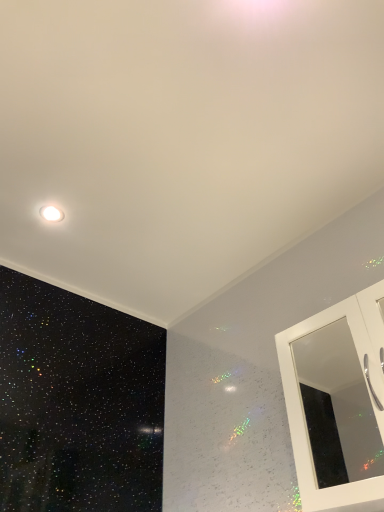
Image resolution: width=384 pixels, height=512 pixels. Describe the element at coordinates (337, 403) in the screenshot. I see `white glossy cabinet door at upper right` at that location.

The height and width of the screenshot is (512, 384). Find the location of `white glossy cabinet door at upper right`. white glossy cabinet door at upper right is located at coordinates (337, 403).

What is the approximate width of white glossy cabinet door at upper right?

It is 6.50 inches.

Where is `white glossy cabinet door at upper right`? This screenshot has width=384, height=512. white glossy cabinet door at upper right is located at coordinates (337, 403).